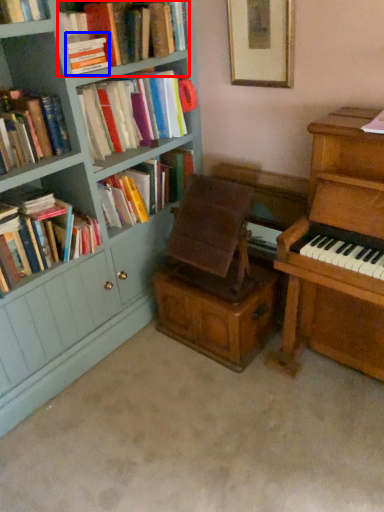
Question: Which point is closer to the camera, book (highlighted by a red box) or book (highlighted by a blue box)?

Choices:
 (A) book
 (B) book

Answer: (A)